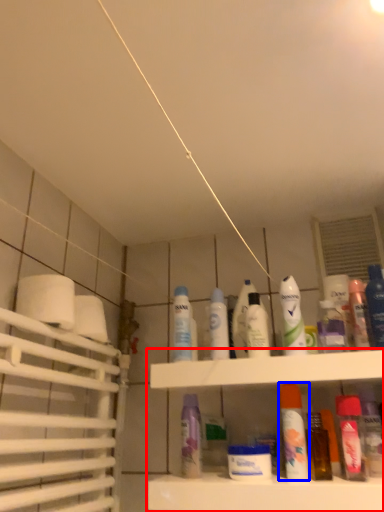
Question: Which of the following is the closest to the observer, shelf (highlighted by a red box) or mouthwash (highlighted by a blue box)?

Choices:
 (A) shelf
 (B) mouthwash

Answer: (A)